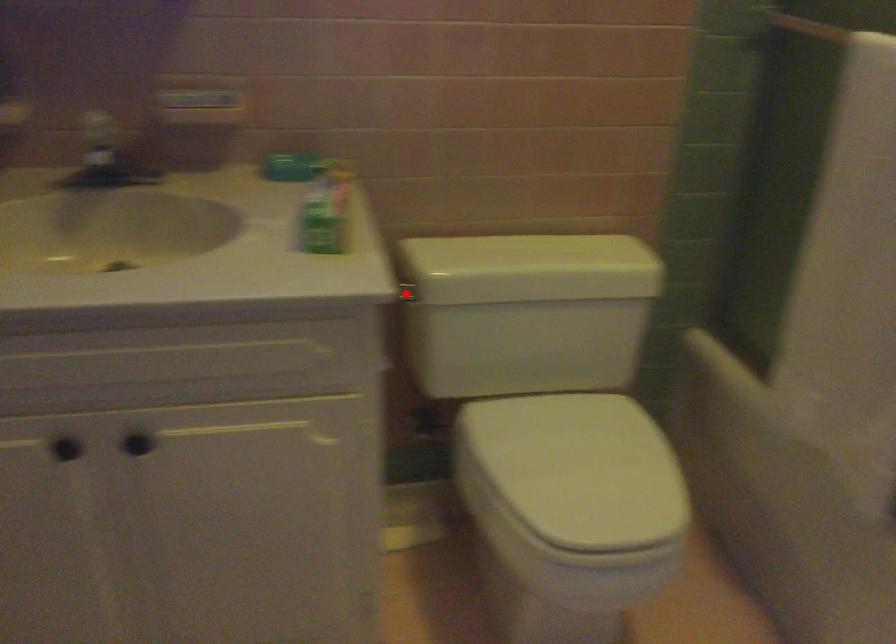
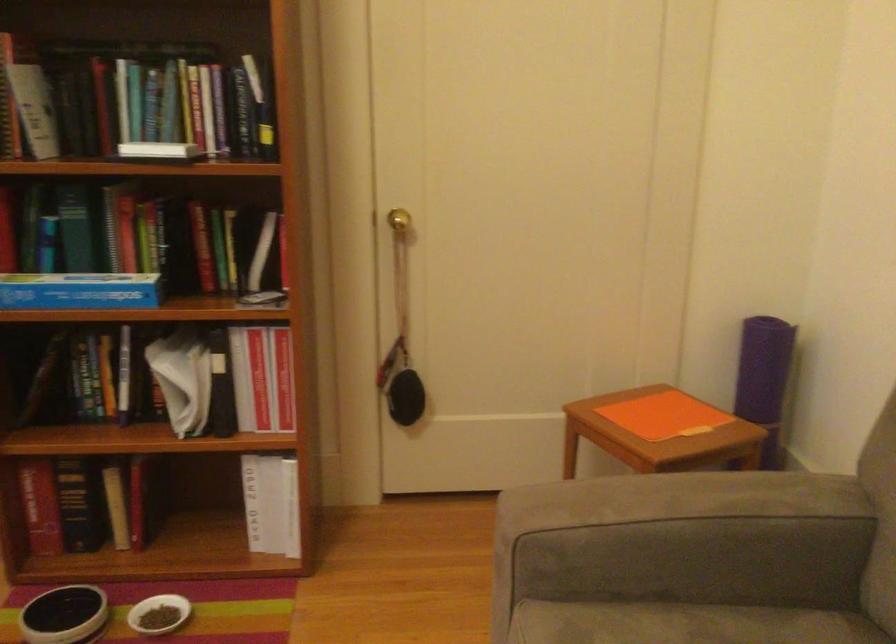
Question: I am providing you with two images of the same scene from different viewpoints. A red point is marked on the first image. Can you still see the location of the red point in image 2?

Choices:
 (A) Yes
 (B) No

Answer: (B)